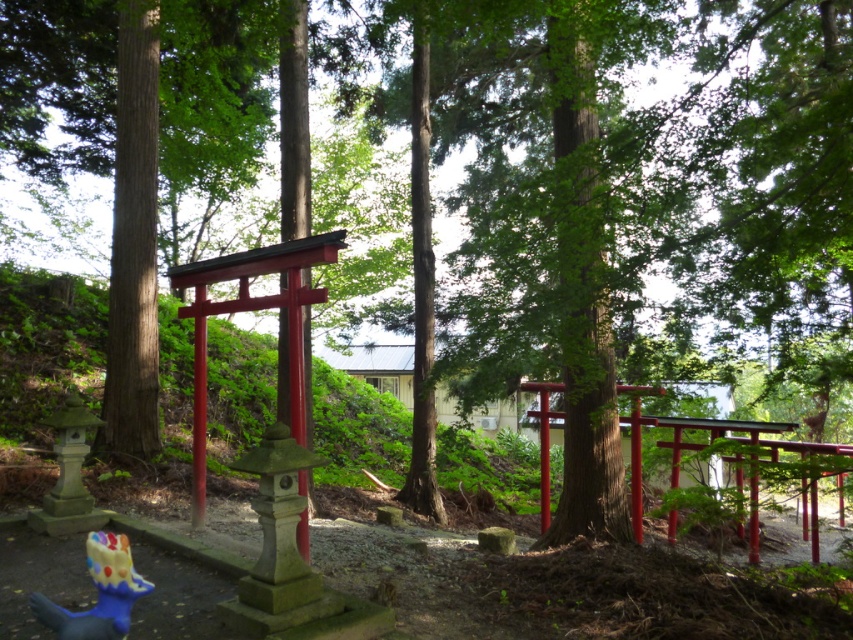
Is metallic red torii gate at center closer to camera compared to blue rubber toy at lower left?

No.

What do you see at coordinates (698, 444) in the screenshot? I see `metallic red torii gate at center` at bounding box center [698, 444].

Where is `metallic red torii gate at center`? The image size is (853, 640). metallic red torii gate at center is located at coordinates (698, 444).